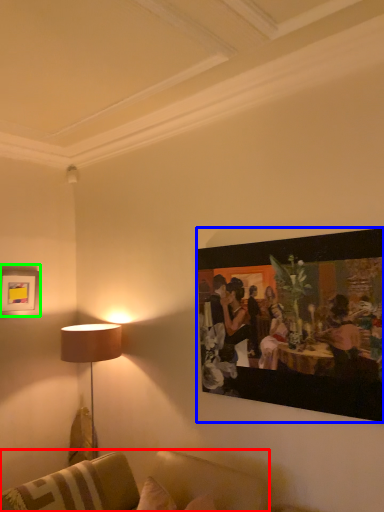
Question: Which object is the closest to the studio couch (highlighted by a red box)? Choose among these: picture frame (highlighted by a blue box) or picture frame (highlighted by a green box).

Choices:
 (A) picture frame
 (B) picture frame

Answer: (A)